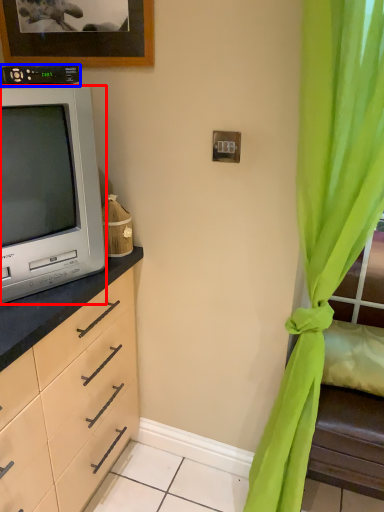
Question: Which object appears closest to the camera in this image, television (highlighted by a red box) or appliance (highlighted by a blue box)?

Choices:
 (A) television
 (B) appliance

Answer: (A)